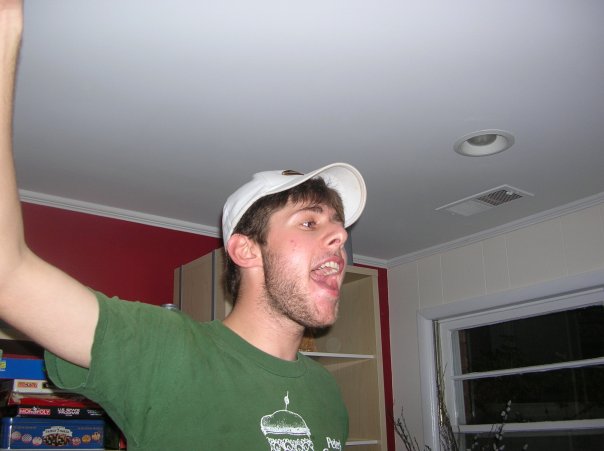
Find the location of `ceiling light`. ceiling light is located at coordinates (486, 140).